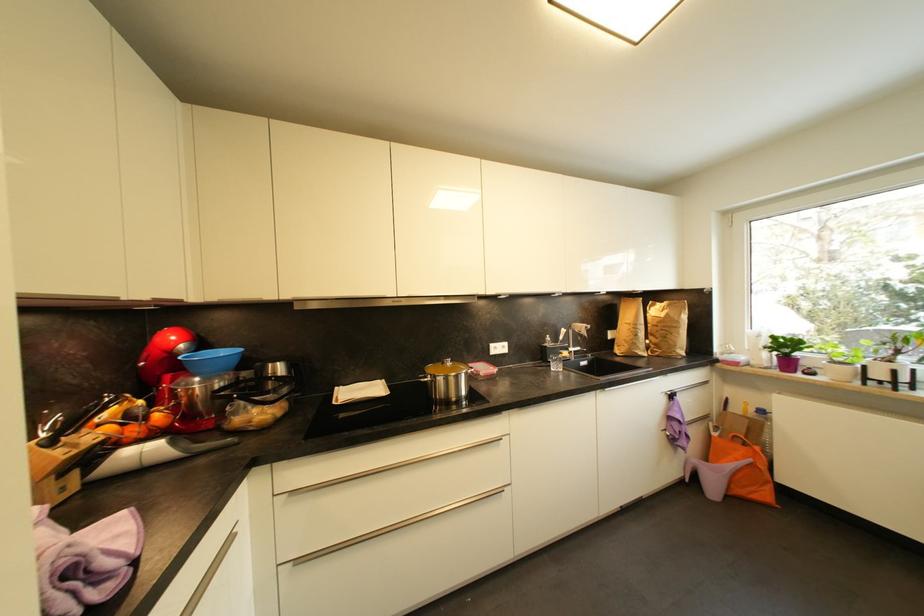
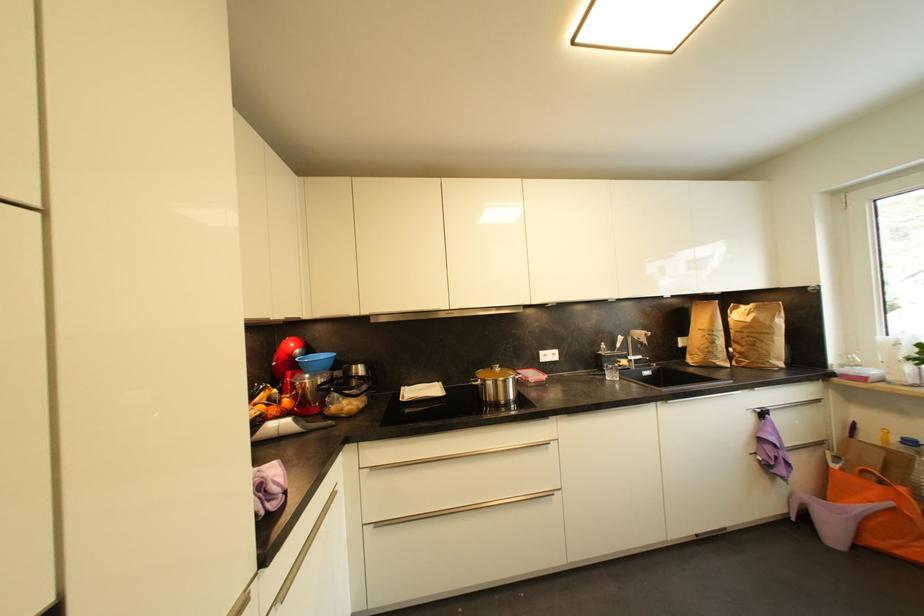
Find the pixel in the second image that matches pixel 454 365 in the first image.

(503, 371)